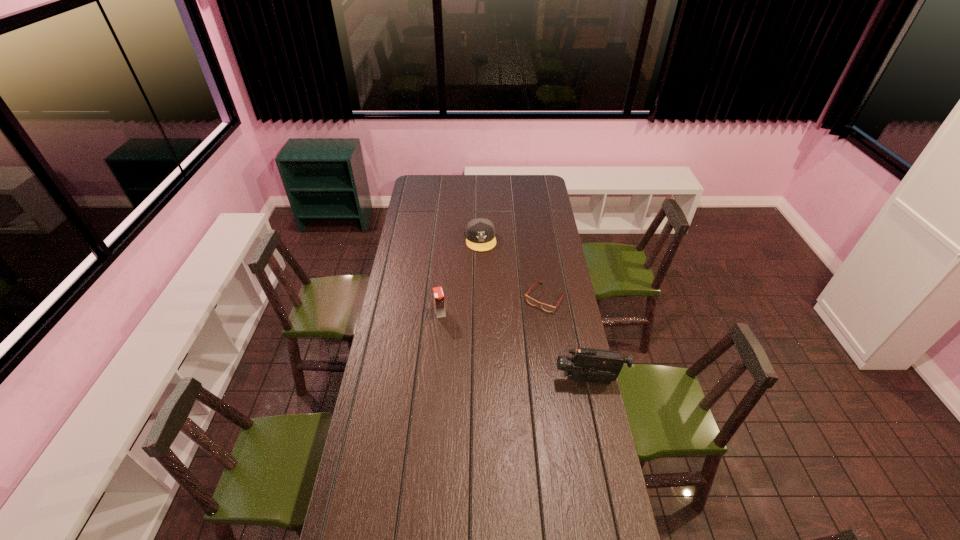
At what (x,y) coordinates should I click in order to perform the action: click on the leftmost object. Please return your answer as a coordinate pair (x, y). Looking at the image, I should click on (439, 303).

In order to click on orange juice in this screenshot , I will do `click(439, 303)`.

You are a GUI agent. You are given a task and a screenshot of the screen. Output one action in this format:
    pyautogui.click(x=<x>, y=<y>)
    Task: Click on the nearest object
    This screenshot has height=540, width=960.
    Given the screenshot: What is the action you would take?
    pyautogui.click(x=586, y=365)

I want to click on the tallest object, so click(x=586, y=365).

Locate an element on the screen. This screenshot has width=960, height=540. cap is located at coordinates (480, 233).

Identify the location of the farthest object. Image resolution: width=960 pixels, height=540 pixels. (480, 233).

Identify the location of spectacles. (548, 308).

Image resolution: width=960 pixels, height=540 pixels. Find the location of `free location located on the back of the second tallest object`. free location located on the back of the second tallest object is located at coordinates (444, 266).

Where is `vacant space located 0.160m on the front-facing side of the tallest object`? The width and height of the screenshot is (960, 540). vacant space located 0.160m on the front-facing side of the tallest object is located at coordinates (516, 380).

This screenshot has width=960, height=540. I want to click on vacant space located 0.160m on the front-facing side of the tallest object, so click(x=516, y=380).